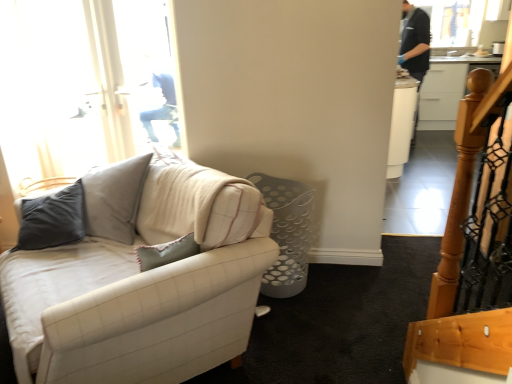
Question: In terms of size, does white fabric couch at left appear bigger or smaller than white glossy cabinet at upper right?

Choices:
 (A) small
 (B) big

Answer: (B)

Question: From the image's perspective, relative to white glossy cabinet at upper right, is white fabric couch at left above or below?

Choices:
 (A) below
 (B) above

Answer: (A)

Question: Is white fabric couch at left taller or shorter than white glossy cabinet at upper right?

Choices:
 (A) short
 (B) tall

Answer: (A)

Question: From the image's perspective, is white glossy cabinet at upper right positioned above or below white fabric couch at left?

Choices:
 (A) below
 (B) above

Answer: (B)

Question: Looking at their shapes, would you say white glossy cabinet at upper right is wider or thinner than white fabric couch at left?

Choices:
 (A) thin
 (B) wide

Answer: (A)

Question: From a real-world perspective, relative to white fabric couch at left, is white glossy cabinet at upper right vertically above or below?

Choices:
 (A) below
 (B) above

Answer: (A)

Question: Considering the relative positions of white glossy cabinet at upper right and white fabric couch at left in the image provided, is white glossy cabinet at upper right to the left or to the right of white fabric couch at left?

Choices:
 (A) right
 (B) left

Answer: (A)